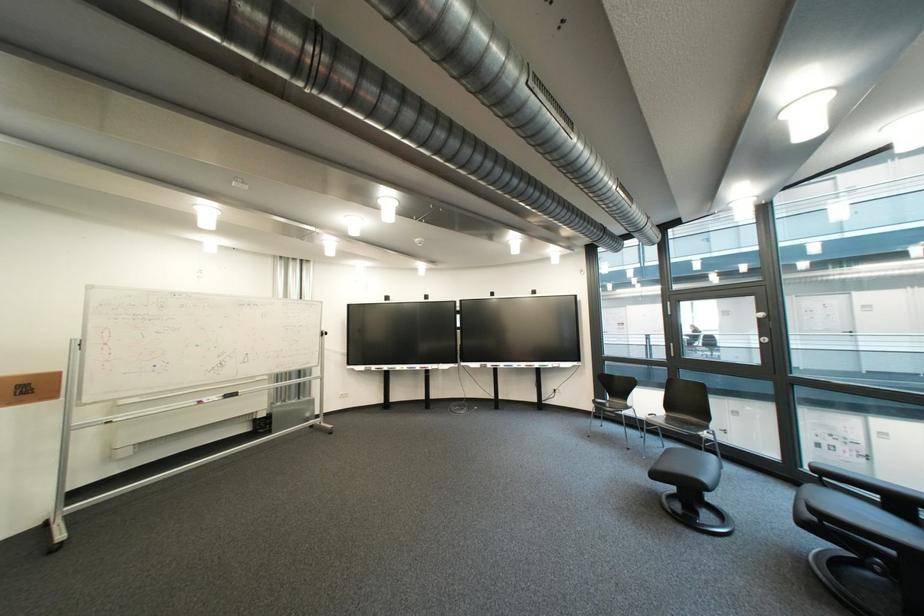
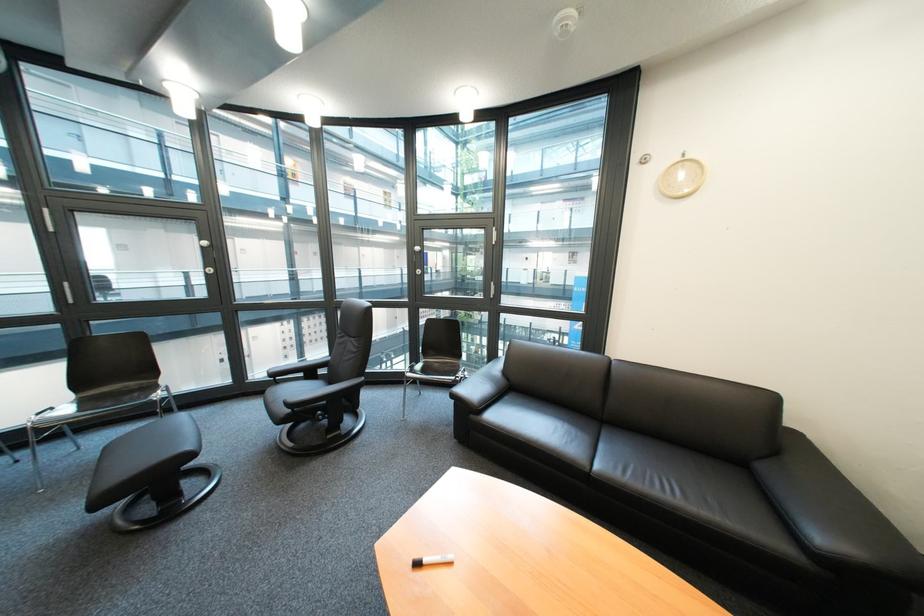
Where in the second image is the point corresponding to (681,453) from the first image?

(119, 450)